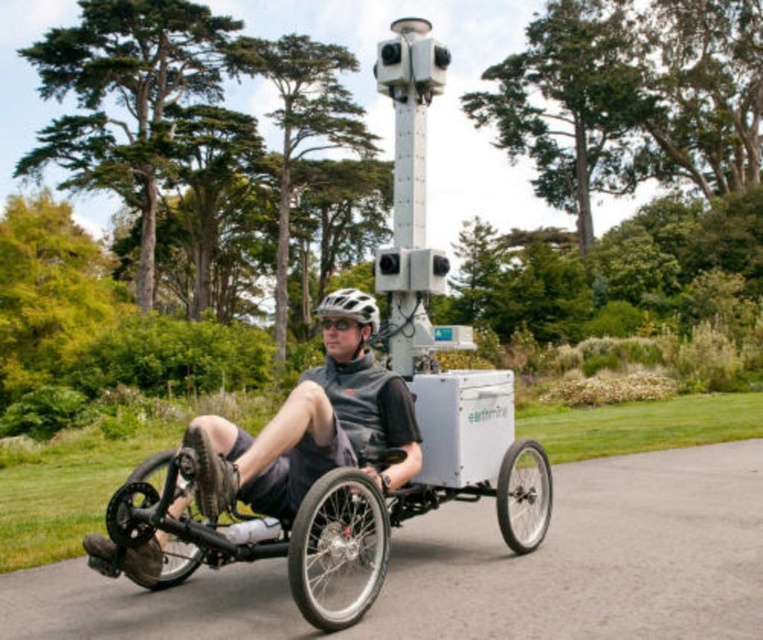
Question: Which point is closer to the camera?

Choices:
 (A) (198, 560)
 (B) (204, 476)
 (C) (522, 547)

Answer: (B)

Question: Which of the following is the closest to the observer?

Choices:
 (A) (179, 460)
 (B) (542, 536)
 (C) (143, 557)

Answer: (A)

Question: From the image, what is the correct spatial relationship of black rubber wheel at lower right in relation to black rubber wheel at lower left?

Choices:
 (A) right
 (B) left

Answer: (A)

Question: Is black rubber wheel at lower right thinner than black rubber wheel at lower left?

Choices:
 (A) no
 (B) yes

Answer: (B)

Question: Can you confirm if matte black trike at center is bigger than white matte bicycle helmet at center?

Choices:
 (A) no
 (B) yes

Answer: (A)

Question: Estimate the real-world distances between objects in this image. Which object is closer to the black rubber wheel at lower left?

Choices:
 (A) matte black trike at center
 (B) shiny silver rim at center
 (C) white matte bicycle helmet at center

Answer: (A)